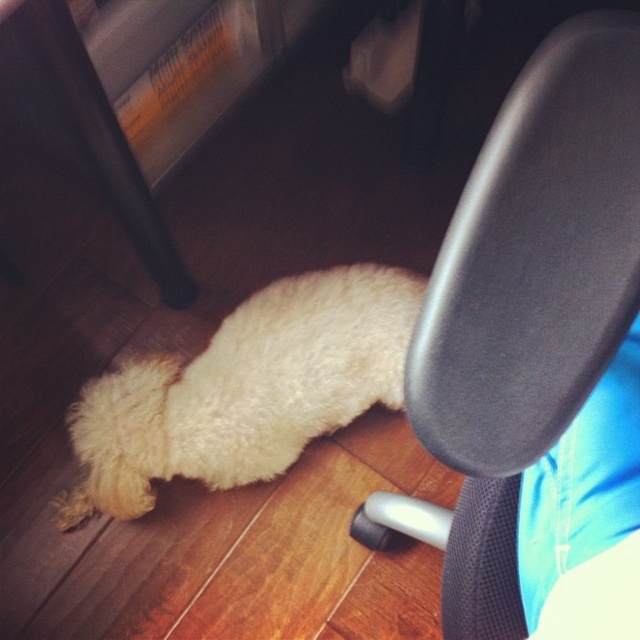
You are standing in the room and want to place a new plant pot at the point marked by the coordinates point (538, 356). What object is currently occupying that location?

The black mesh chair at center is located at point (538, 356), so that location is currently occupied by the black mesh chair at center.

You are a delivery person entering the room and need to place a package on the floor between the black mesh chair at center and the white fluffy dog at lower left. Based on their positions, which side of the dog should you place the package to ensure it is between them?

The black mesh chair at center is to the right of the white fluffy dog at lower left, so you should place the package to the right side of the white fluffy dog at lower left to keep it between them.

You are a delivery robot with a 16 inch wide package. You need to place it between the black mesh chair at center and the white fluffy dog at lower left. Is there enough space between them to fit the package?

The black mesh chair at center and white fluffy dog at lower left are 17.70 inches apart, so yes, the 16 inch wide package can fit between them since there is enough space.